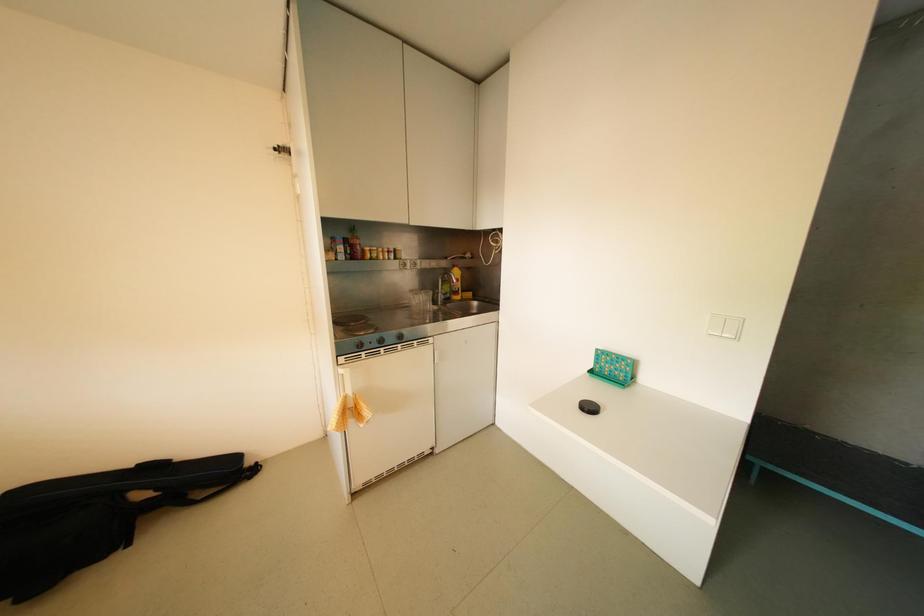
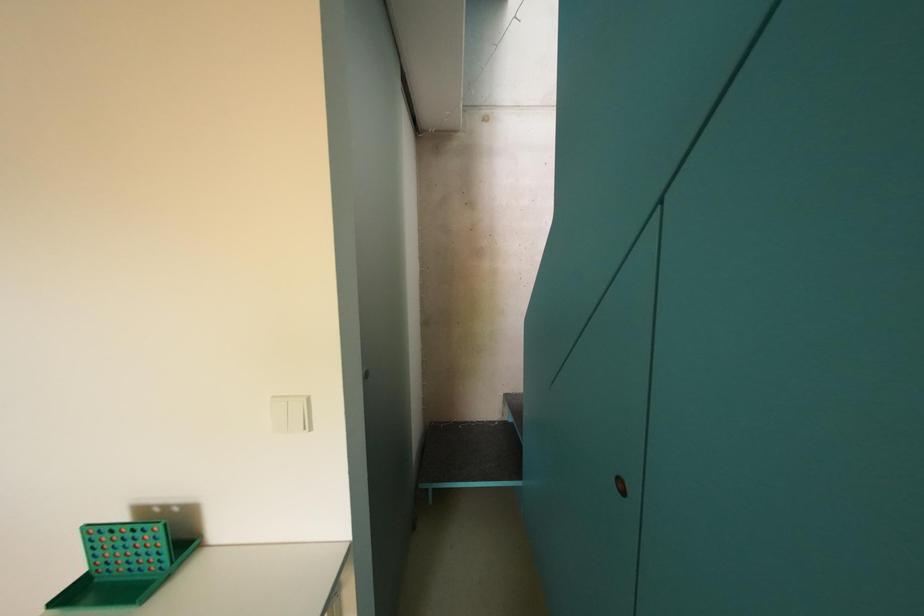
Question: The first image is from the beginning of the video and the second image is from the end. How did the camera likely rotate when shooting the video?

Choices:
 (A) Left
 (B) Right
 (C) Up
 (D) Down

Answer: (B)